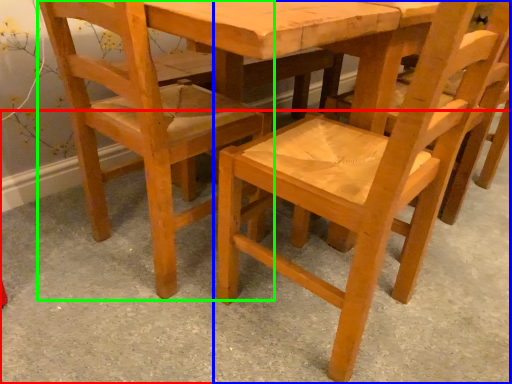
Question: Based on their relative distances, which object is farther from concrete (highlighted by a red box)? Choose from chair (highlighted by a blue box) and chair (highlighted by a green box).

Choices:
 (A) chair
 (B) chair

Answer: (B)